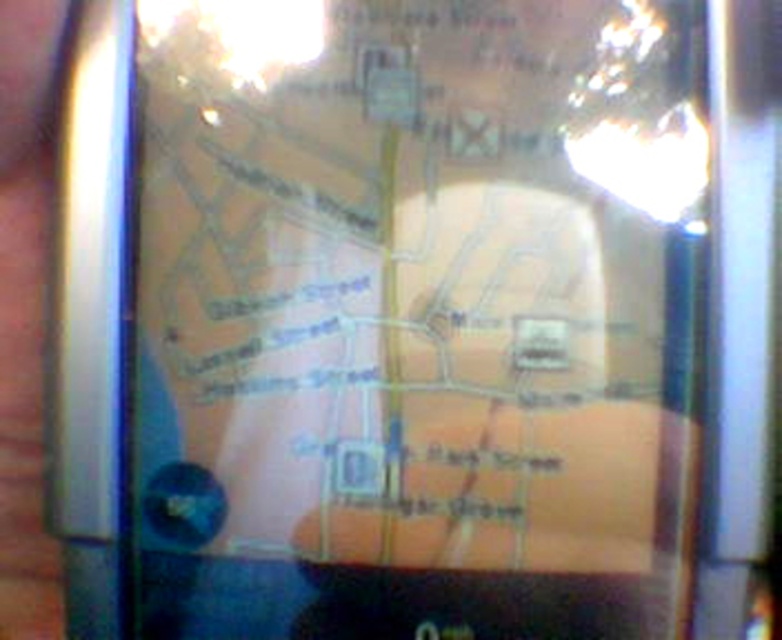
Question: Which point is closer to the camera?

Choices:
 (A) (199, 621)
 (B) (22, 344)

Answer: (A)

Question: Can you confirm if translucent plastic map at center is thinner than gold metallic pen at center?

Choices:
 (A) no
 (B) yes

Answer: (A)

Question: Which point is closer to the camera?

Choices:
 (A) translucent plastic map at center
 (B) gold metallic pen at center

Answer: (B)

Question: Can you confirm if translucent plastic map at center is bigger than gold metallic pen at center?

Choices:
 (A) yes
 (B) no

Answer: (A)

Question: Observing the image, what is the correct spatial positioning of translucent plastic map at center in reference to gold metallic pen at center?

Choices:
 (A) right
 (B) left

Answer: (A)